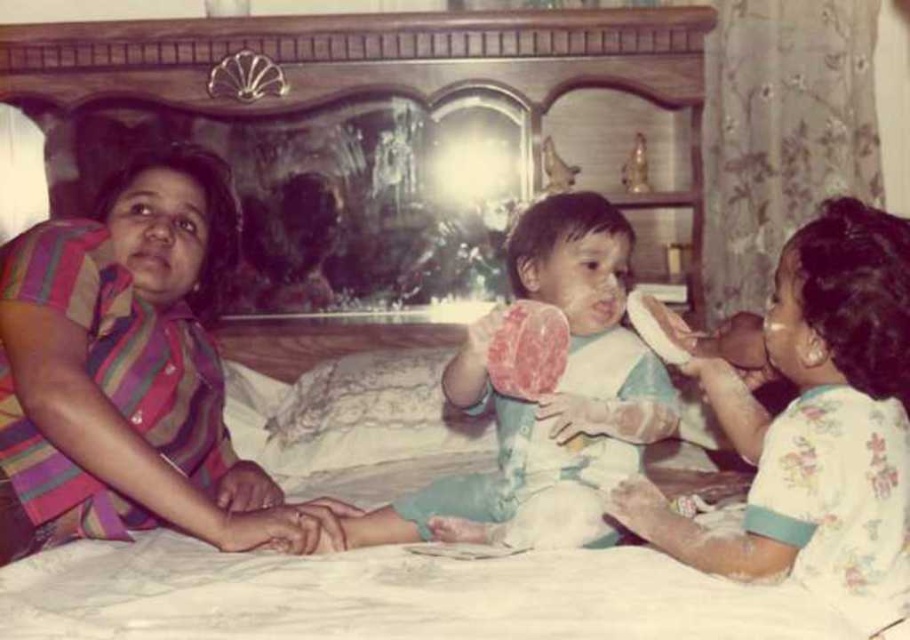
You are a parent observing your child playing on the bed. You notice the white cotton shirt at center and the white cotton bib at center. Which one is closer to the child?

The white cotton bib at center is closer to the child because it is positioned below the white cotton shirt at center, which is above it.